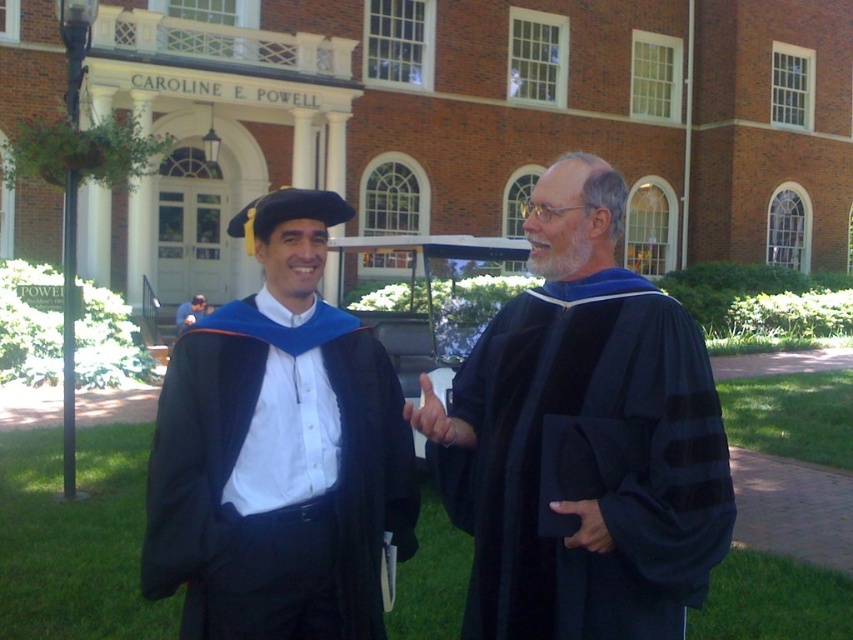
From the picture: You are a photographer at the graduation ceremony. You need to capture a photo where both the black matte graduation gown at center and the matte black robe at center are clearly visible. Which one should you focus on first to ensure the other is in the frame?

The black matte graduation gown at center is positioned on the right side of matte black robe at center, so you should focus on the matte black robe at center first to ensure the black matte graduation gown at center remains in the frame.